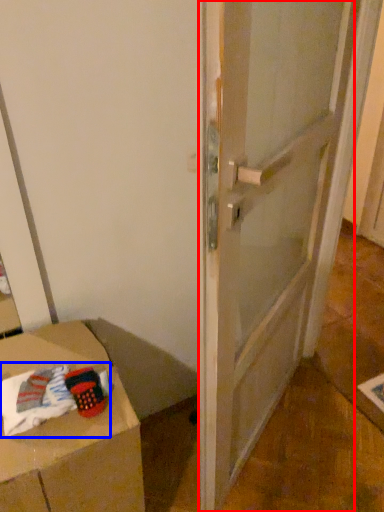
Question: Which object appears farthest to the camera in this image, door (highlighted by a red box) or laundry (highlighted by a blue box)?

Choices:
 (A) door
 (B) laundry

Answer: (B)